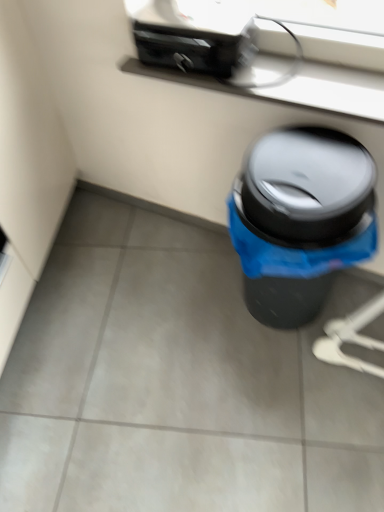
Question: Looking at their shapes, would you say black plastic trash can at lower right is wider or thinner than black plastic toaster at upper center?

Choices:
 (A) thin
 (B) wide

Answer: (B)

Question: From the image's perspective, relative to black plastic toaster at upper center, is black plastic trash can at lower right above or below?

Choices:
 (A) below
 (B) above

Answer: (A)

Question: Estimate the real-world distances between objects in this image. Which object is closer to the black plastic trash can at lower right?

Choices:
 (A) satin black window sill at upper center
 (B) black plastic toaster at upper center

Answer: (A)

Question: Based on their relative distances, which object is nearer to the black plastic trash can at lower right?

Choices:
 (A) satin black window sill at upper center
 (B) black plastic toaster at upper center

Answer: (A)